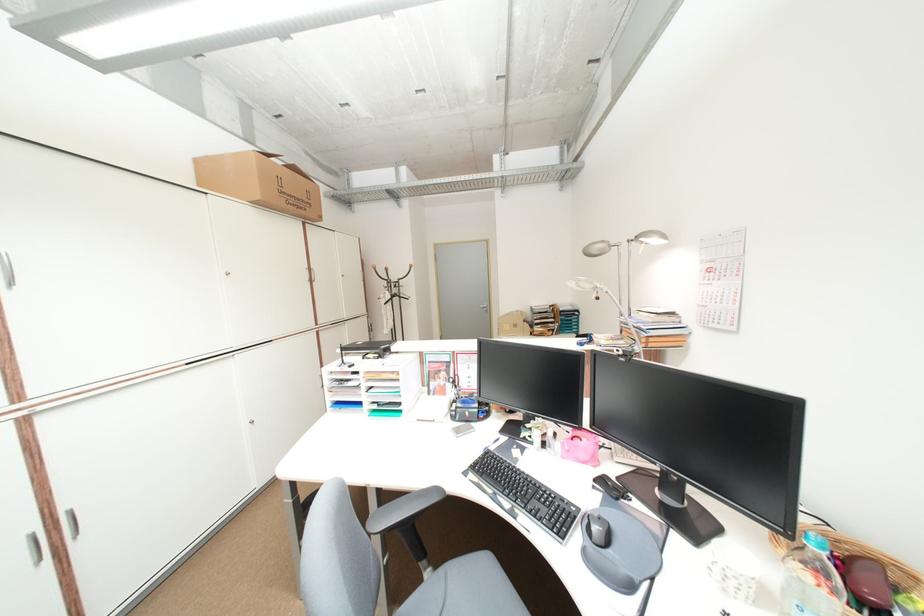
Describe the element at coordinates (403, 509) in the screenshot. Image resolution: width=924 pixels, height=616 pixels. I see `the black chair armrest` at that location.